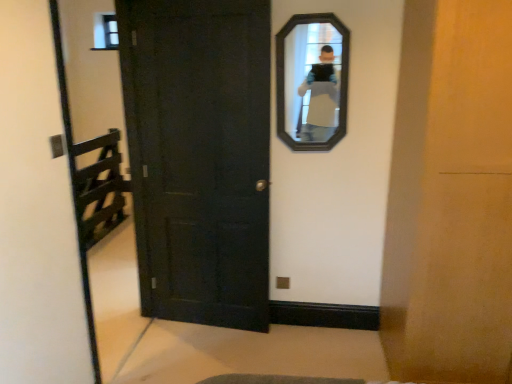
Question: Choose the correct answer: Is black wooden mirror at upper center inside matte black door at center or outside it?

Choices:
 (A) outside
 (B) inside

Answer: (A)

Question: Visually, is black wooden mirror at upper center positioned to the left or to the right of matte black door at center?

Choices:
 (A) right
 (B) left

Answer: (A)

Question: In terms of width, does black wooden mirror at upper center look wider or thinner when compared to matte black door at center?

Choices:
 (A) thin
 (B) wide

Answer: (A)

Question: Considering the positions of matte black door at center and black wooden mirror at upper center in the image, is matte black door at center taller or shorter than black wooden mirror at upper center?

Choices:
 (A) short
 (B) tall

Answer: (B)

Question: Is matte black door at center wider or thinner than black wooden mirror at upper center?

Choices:
 (A) wide
 (B) thin

Answer: (A)

Question: Is point (152, 142) positioned closer to the camera than point (295, 41)?

Choices:
 (A) closer
 (B) farther

Answer: (B)

Question: From the image's perspective, is matte black door at center above or below black wooden mirror at upper center?

Choices:
 (A) below
 (B) above

Answer: (A)